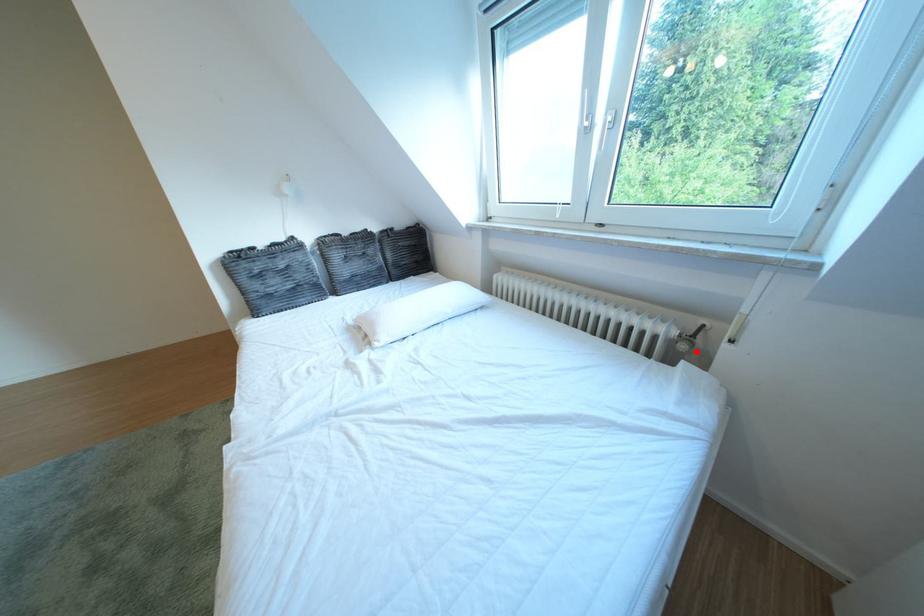
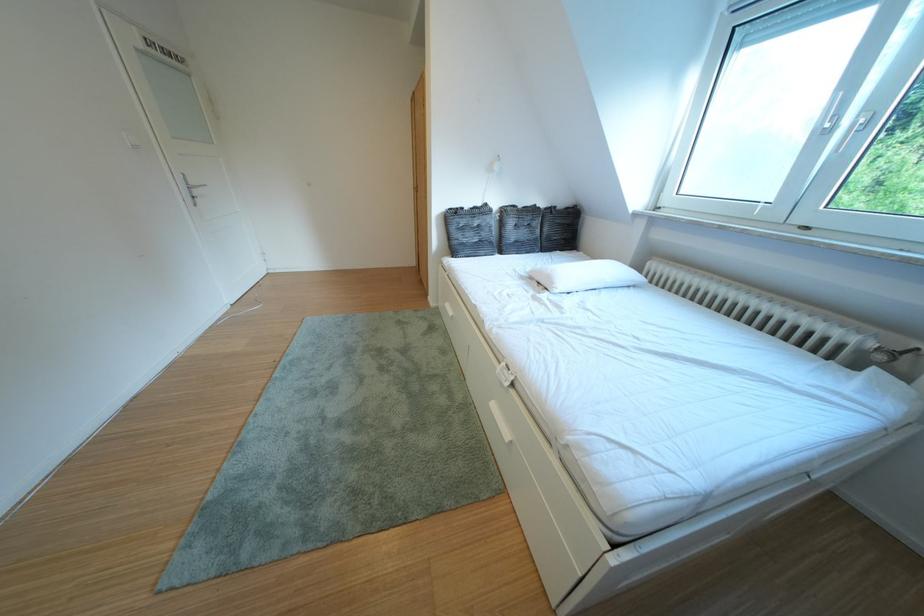
Find the pixel in the second image that matches the highlighted location in the first image.

(893, 363)